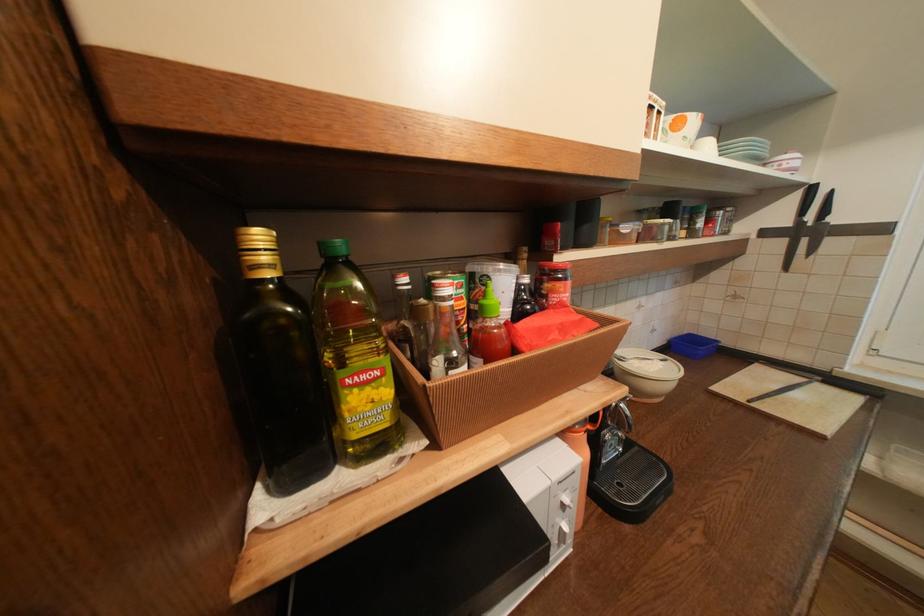
Identify the location of red sauce bottle. The image size is (924, 616). (552, 268).